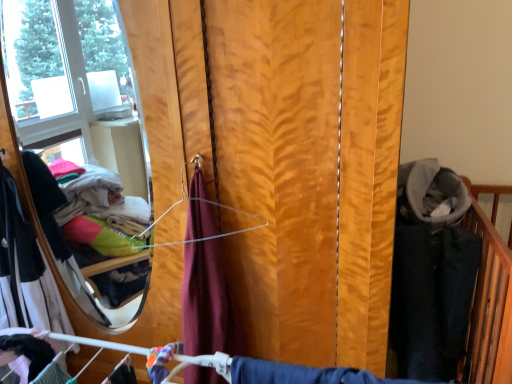
Question: Should I look upward or downward to see white cotton dress at left, the first clothing from the back?

Choices:
 (A) down
 (B) up

Answer: (A)

Question: From the image's perspective, is white cotton dress at left, which ranks as the 1th clothing in left-to-right order, under matte black fabric at lower left, marked as the 1th clothing in a front-to-back arrangement?

Choices:
 (A) no
 (B) yes

Answer: (A)

Question: From the image's perspective, is white cotton dress at left, which ranks as the 1th clothing in left-to-right order, on top of matte black fabric at lower left, marked as the 1th clothing in a front-to-back arrangement?

Choices:
 (A) no
 (B) yes

Answer: (B)

Question: Considering the relative sizes of white cotton dress at left, the second clothing positioned from the front, and matte black fabric at lower left, the second clothing positioned from the back, in the image provided, is white cotton dress at left, the second clothing positioned from the front, smaller than matte black fabric at lower left, the second clothing positioned from the back,?

Choices:
 (A) yes
 (B) no

Answer: (B)

Question: Could you tell me if white cotton dress at left, the second clothing positioned from the front, is facing matte black fabric at lower left, marked as the 1th clothing in a front-to-back arrangement?

Choices:
 (A) yes
 (B) no

Answer: (B)

Question: Is matte black fabric at lower left, the second clothing in the left-to-right sequence, inside white cotton dress at left, acting as the second clothing starting from the right?

Choices:
 (A) no
 (B) yes

Answer: (A)

Question: Considering the relative positions of white cotton dress at left, the second clothing positioned from the front, and matte black fabric at lower left, marked as the 1th clothing in a front-to-back arrangement, in the image provided, is white cotton dress at left, the second clothing positioned from the front, in front of matte black fabric at lower left, marked as the 1th clothing in a front-to-back arrangement,?

Choices:
 (A) yes
 (B) no

Answer: (B)

Question: Is matte black fabric at lower left, the second clothing positioned from the back, at the back of wooden blinds at center?

Choices:
 (A) yes
 (B) no

Answer: (A)

Question: Is wooden blinds at center beside matte black fabric at lower left, the second clothing in the left-to-right sequence?

Choices:
 (A) no
 (B) yes

Answer: (A)

Question: Is wooden blinds at center at the right side of matte black fabric at lower left, the second clothing in the left-to-right sequence?

Choices:
 (A) no
 (B) yes

Answer: (B)

Question: From a real-world perspective, is wooden blinds at center located beneath matte black fabric at lower left, marked as the 1th clothing in a front-to-back arrangement?

Choices:
 (A) no
 (B) yes

Answer: (A)

Question: Is wooden blinds at center facing towards matte black fabric at lower left, the second clothing positioned from the back?

Choices:
 (A) no
 (B) yes

Answer: (B)

Question: Is wooden blinds at center not inside matte black fabric at lower left, the second clothing in the left-to-right sequence?

Choices:
 (A) yes
 (B) no

Answer: (A)

Question: Considering the relative sizes of wooden blinds at center and white cotton dress at left, the first clothing from the back, in the image provided, is wooden blinds at center bigger than white cotton dress at left, the first clothing from the back,?

Choices:
 (A) yes
 (B) no

Answer: (A)